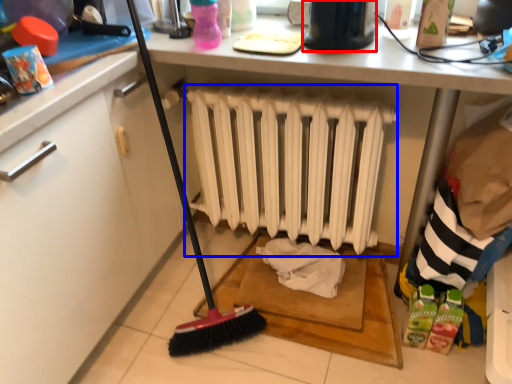
Question: Which object is further to the camera taking this photo, appliance (highlighted by a red box) or radiator (highlighted by a blue box)?

Choices:
 (A) appliance
 (B) radiator

Answer: (B)